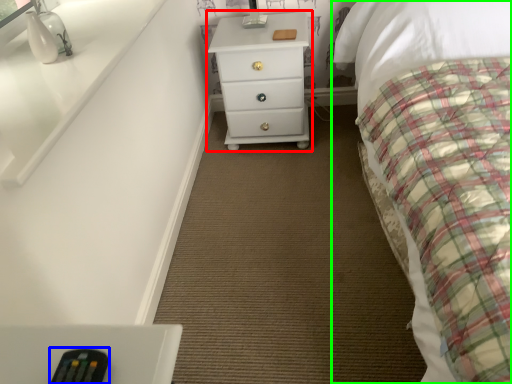
Question: Which is nearer to the chest of drawers (highlighted by a red box)? remote (highlighted by a blue box) or bed (highlighted by a green box).

Choices:
 (A) remote
 (B) bed

Answer: (B)